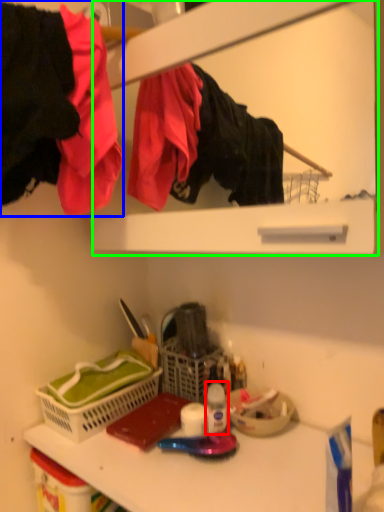
Question: Which object is positioned closest to bottle (highlighted by a red box)? Select from clothing (highlighted by a blue box) and medicine cabinet (highlighted by a green box).

Choices:
 (A) clothing
 (B) medicine cabinet

Answer: (A)